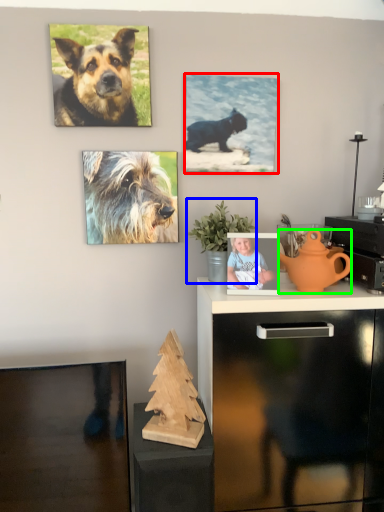
Question: Which object is positioned farthest from picture frame (highlighted by a red box)? Select from houseplant (highlighted by a blue box) and teapot (highlighted by a green box).

Choices:
 (A) houseplant
 (B) teapot

Answer: (B)